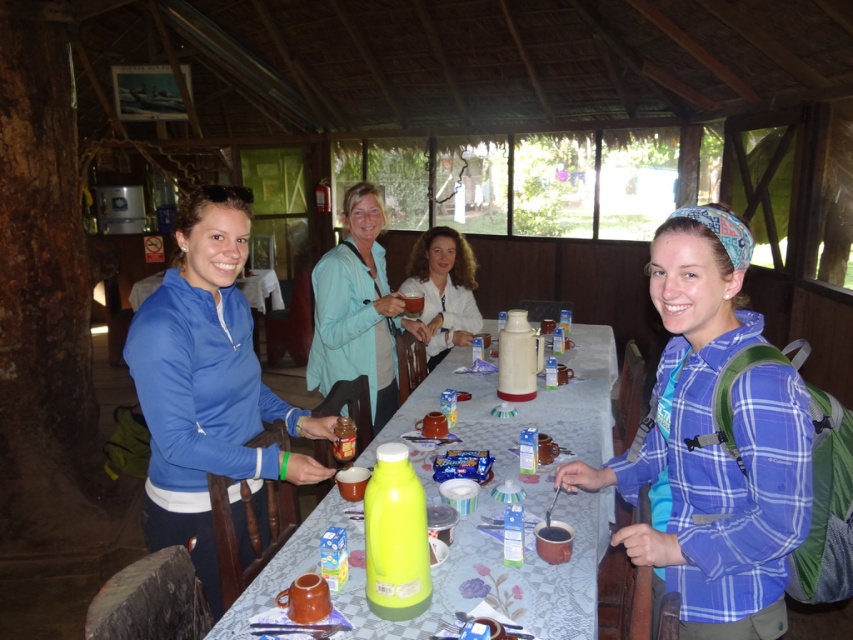
Question: Considering the real-world distances, which object is closest to the matte blue sweatshirt at left?

Choices:
 (A) translucent plastic bottle at center
 (B) light blue fabric shirt at center
 (C) blue plaid shirt at center
 (D) white matte shirt at center

Answer: (A)

Question: Does translucent plastic bottle at center have a greater width compared to white matte shirt at center?

Choices:
 (A) no
 (B) yes

Answer: (B)

Question: Which point is farther to the camera?

Choices:
 (A) (157, 433)
 (B) (706, 312)
 (C) (467, 324)

Answer: (C)

Question: Is translucent plastic bottle at center above white matte shirt at center?

Choices:
 (A) no
 (B) yes

Answer: (A)

Question: From the image, what is the correct spatial relationship of light blue fabric shirt at center in relation to white matte shirt at center?

Choices:
 (A) right
 (B) left

Answer: (B)

Question: Which point appears closest to the camera in this image?

Choices:
 (A) (184, 371)
 (B) (317, 321)
 (C) (747, 628)
 (D) (599, 380)

Answer: (C)